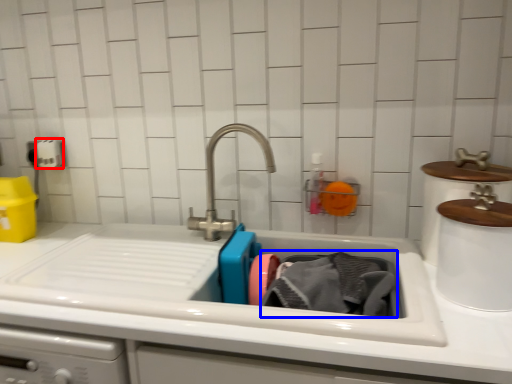
Question: Which object appears farthest to the camera in this image, toilet paper (highlighted by a red box) or clothing (highlighted by a blue box)?

Choices:
 (A) toilet paper
 (B) clothing

Answer: (A)